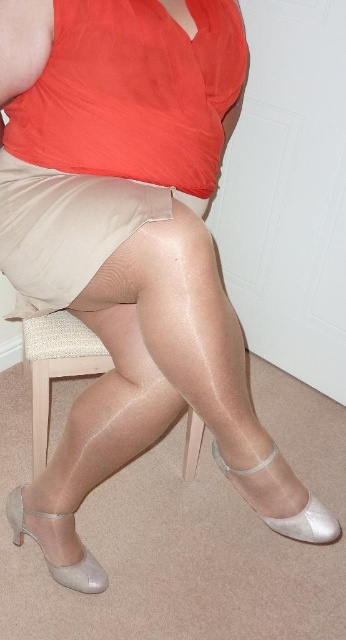
Question: Which of the following is the closest to the observer?

Choices:
 (A) (70, 568)
 (B) (238, 474)

Answer: (B)

Question: Does sheer beige tights at lower center appear on the left side of satin beige sandal at lower left?

Choices:
 (A) no
 (B) yes

Answer: (A)

Question: Where is beige fabric chair at center located in relation to shiny silver sandal at lower center in the image?

Choices:
 (A) right
 (B) left

Answer: (B)

Question: Based on their relative distances, which object is nearer to the beige fabric chair at center?

Choices:
 (A) shiny silver sandal at lower center
 (B) satin beige skirt at center
 (C) sheer beige tights at lower center
 (D) satin beige sandal at lower left

Answer: (C)

Question: Which of the following is the farthest from the observer?

Choices:
 (A) sheer beige tights at lower center
 (B) satin beige skirt at center
 (C) beige fabric chair at center
 (D) satin beige sandal at lower left

Answer: (D)

Question: Is satin beige skirt at center bigger than shiny silver sandal at lower center?

Choices:
 (A) yes
 (B) no

Answer: (A)